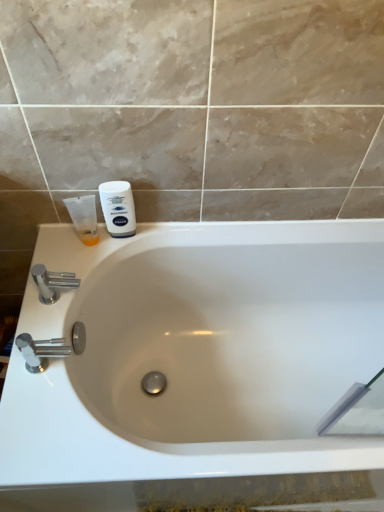
Locate an element on the screen. This screenshot has height=512, width=384. vacant space to the right of white matte shaving cream at upper left, the 2th shaving cream viewed from the left is located at coordinates (174, 230).